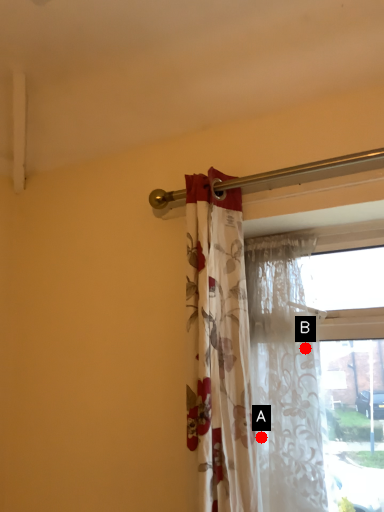
Question: Two points are circled on the image, labeled by A and B beside each circle. Among these points, which one is nearest to the camera?

Choices:
 (A) A is closer
 (B) B is closer

Answer: (B)